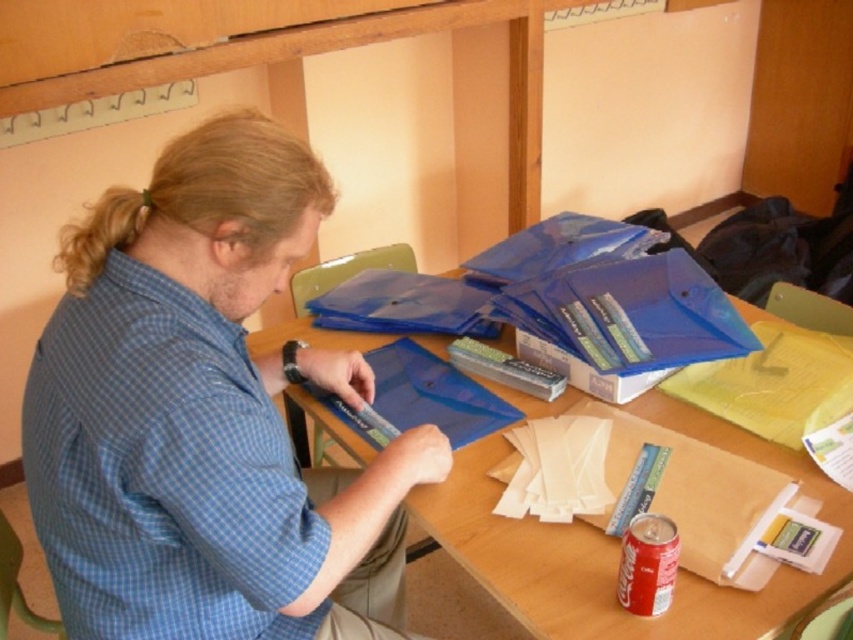
Looking at this image, you are standing at the point labeled as point (543, 499). You want to reach a door located 1.5 meters away from you in the direction opposite to the viewer. How far will you have to walk from your current position to reach the door?

The distance between point (543, 499) and the viewer is 1.21 meters. Since the door is 1.5 meters away from the point in the opposite direction, the total distance to walk is 1.21 meters plus 1.5 meters, totaling 2.71 meters.

You are organizing a desk and need to place the blue matte folder at center and the blonde hair at upper left. Which object requires more space due to its size?

The blue matte folder at center requires more space because it is bigger than the blonde hair at upper left.

You are organizing items on the table and need to place a new item between the blue matte folder at center and the translucent plastic table at center. Is there enough space between them for a small notebook?

The blue matte folder at center is positioned on the left side of the translucent plastic table at center, so there is space between them to place a small notebook.